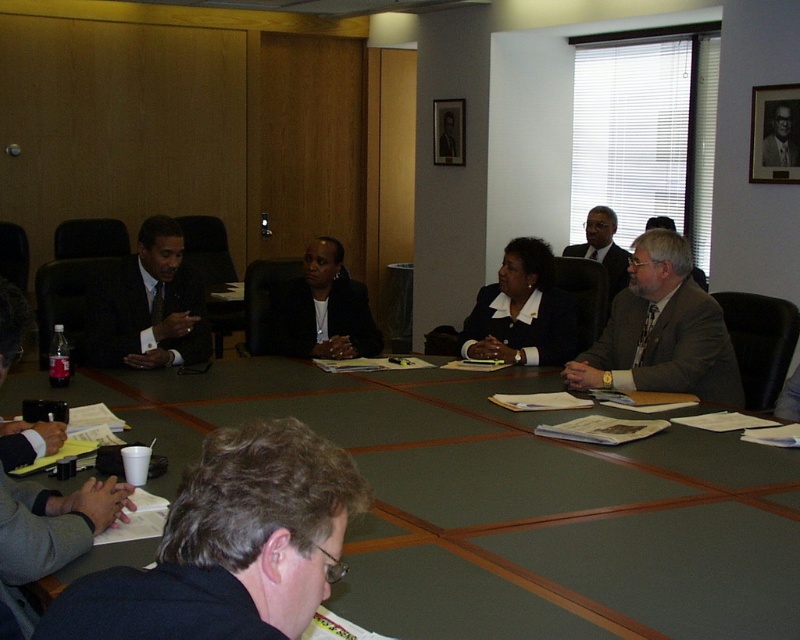
You are organizing a photo shoot and need to arrange two suits on a display table. The matte gray suit at right and the black matte suit at center must be placed side by side. Which suit should you place on the left side to ensure they fit within the table without overlapping?

The black matte suit at center should be placed on the left side because it is narrower than the matte gray suit at right, allowing both to fit side by side without overlapping.

You are standing in the conference room and want to take a photo of the two points mentioned. Which point, point (678, 307) or point (344, 282), will appear larger in the photo?

Point (678, 307) will appear larger in the photo because it is closer to the camera than point (344, 282).

You are attending a meeting in this conference room and need to pass a document to the person wearing the matte gray suit at right. Since you are currently sitting at the green wood table at center, which direction should you move to reach them?

The green wood table at center is below the matte gray suit at right, so you should move upwards from the green wood table at center to reach the matte gray suit at right.